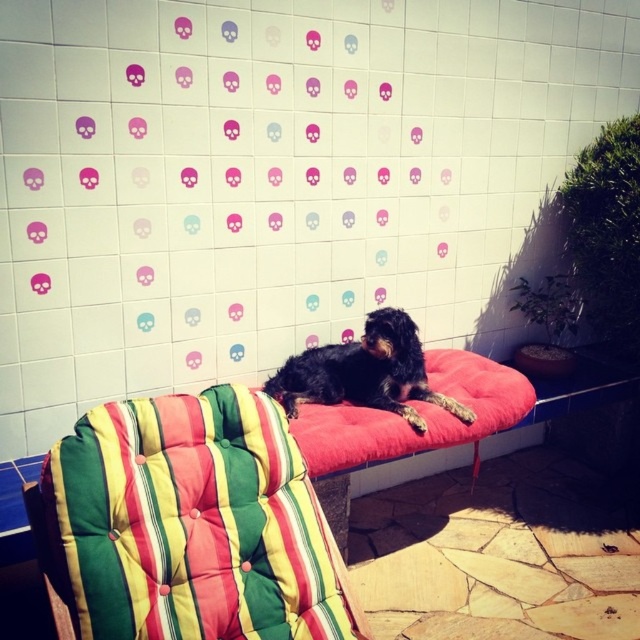
You are standing at the point with coordinates point (326,372) and want to walk towards the point with coordinates point (332,564). Which direction should you move in?

You should move forward because point (332,564) is in front of point (326,372).

You are a photographer trying to capture the black fur dog at center and the striped fabric cushion at center in a single frame. Based on their positions, which object is located to the left of the other?

The striped fabric cushion at center is positioned on the left side of black fur dog at center.